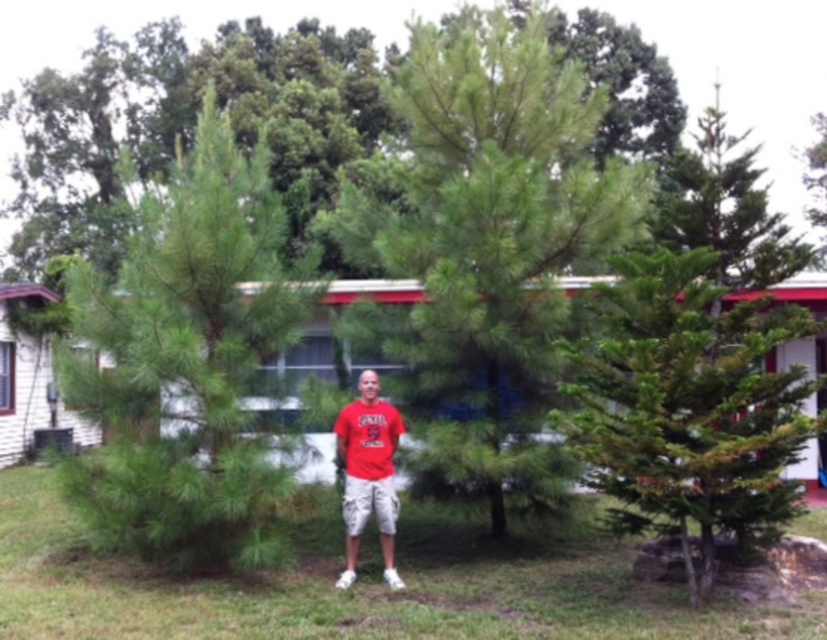
Question: Can you confirm if green needle-like at center is positioned to the left of green leafy trees at center?

Choices:
 (A) yes
 (B) no

Answer: (B)

Question: Among these objects, which one is nearest to the camera?

Choices:
 (A) green needle-like at right
 (B) red cotton t-shirt at center
 (C) green leafy trees at center
 (D) green needle-like at center

Answer: (A)

Question: Which of the following is the farthest from the observer?

Choices:
 (A) (565, 342)
 (B) (22, 588)
 (C) (371, 456)
 (D) (156, 454)

Answer: (C)

Question: Is green needle-like tree at center bigger than green needle-like at center?

Choices:
 (A) no
 (B) yes

Answer: (A)

Question: Which object appears farthest from the camera in this image?

Choices:
 (A) green leafy trees at center
 (B) red cotton t-shirt at center
 (C) green needle-like at right
 (D) green needle-like tree at center

Answer: (A)

Question: Can you confirm if green needle-like at center is thinner than green leafy trees at center?

Choices:
 (A) no
 (B) yes

Answer: (B)